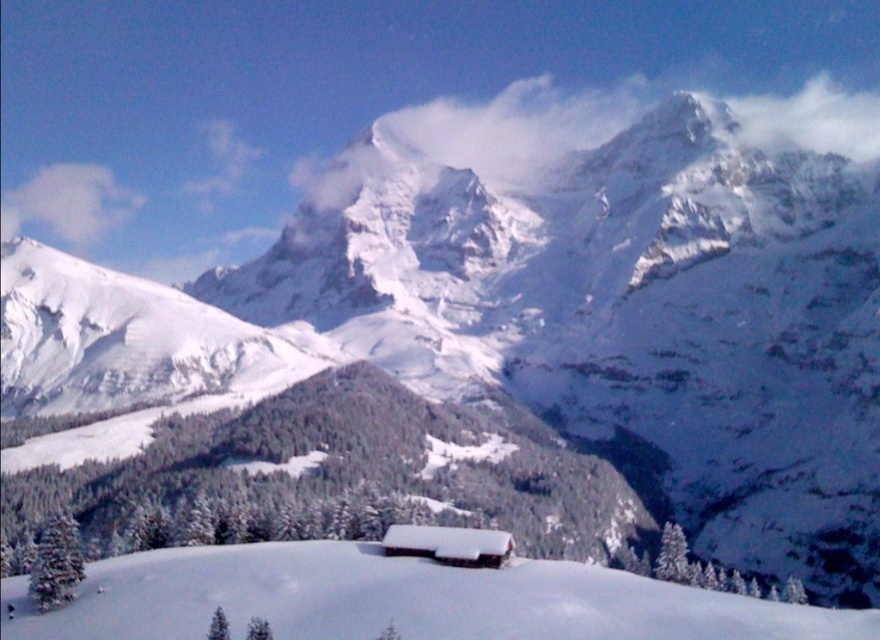
Question: Which is nearer to the white fluffy cloud at upper left?

Choices:
 (A) white snow ski slope at center
 (B) white wooden cabin at center

Answer: (A)

Question: Does white snow ski slope at center have a lesser width compared to white fluffy cloud at upper left?

Choices:
 (A) no
 (B) yes

Answer: (A)

Question: Which point appears farthest from the camera in this image?

Choices:
 (A) (368, 547)
 (B) (101, 212)
 (C) (472, 545)

Answer: (B)

Question: Which object is the closest to the white wooden cabin at center?

Choices:
 (A) white snow ski slope at center
 (B) white fluffy cloud at upper left

Answer: (A)

Question: Can you confirm if white fluffy cloud at upper left is positioned above white wooden cabin at center?

Choices:
 (A) no
 (B) yes

Answer: (B)

Question: Does white snow ski slope at center appear on the left side of white fluffy cloud at upper left?

Choices:
 (A) no
 (B) yes

Answer: (A)